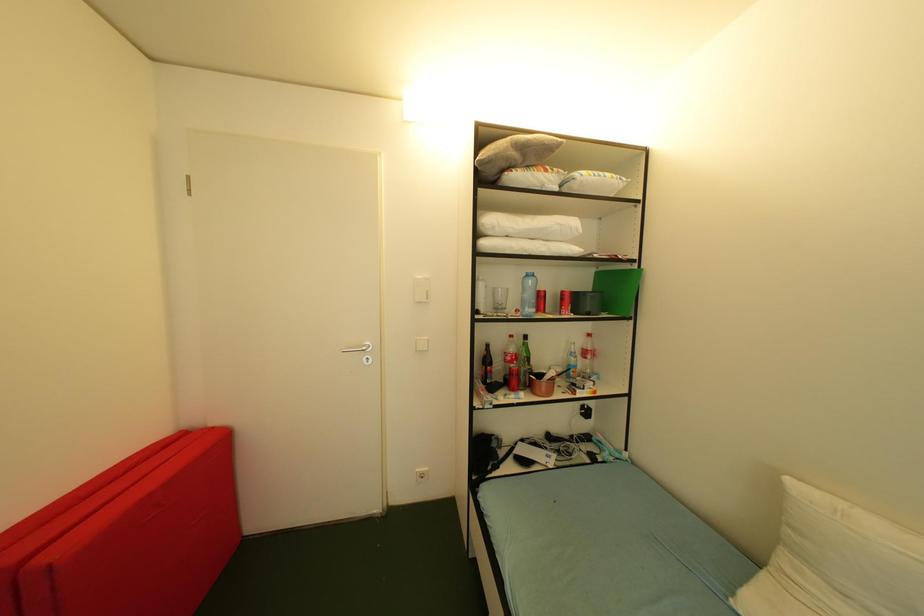
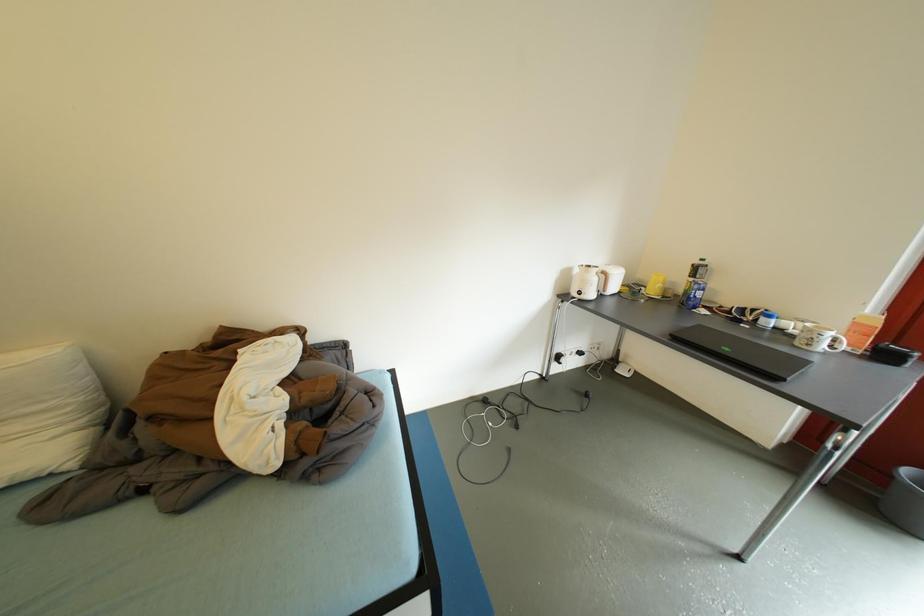
The images are taken continuously from a first-person perspective. In which direction is your viewpoint rotating?

The camera's rotation is toward right-down.